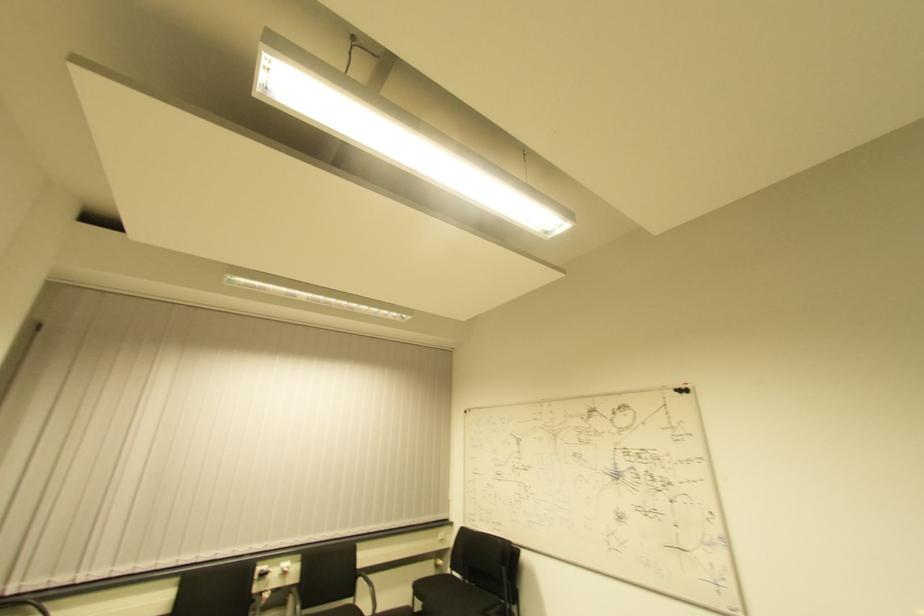
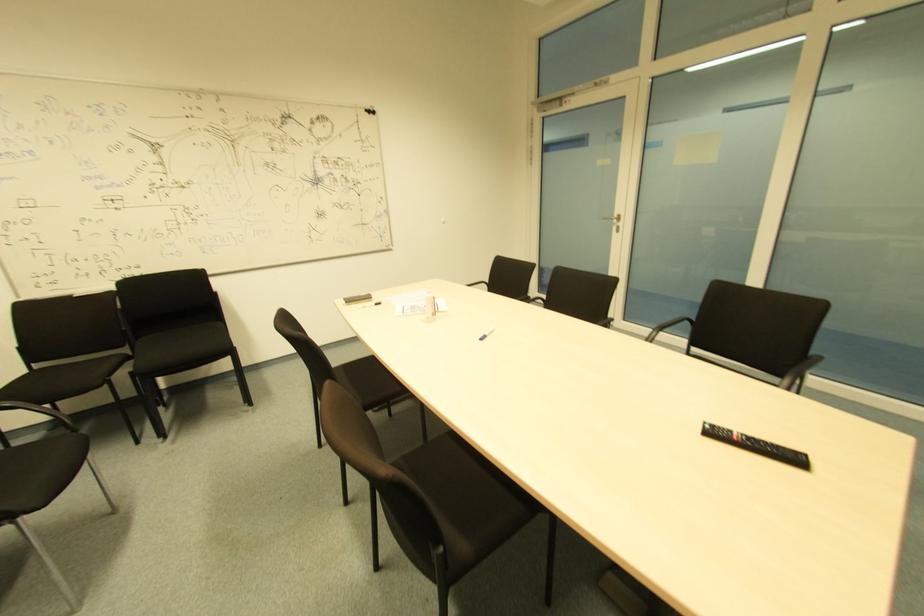
Locate, in the second image, the point that corresponds to [454,576] in the first image.

(34, 370)